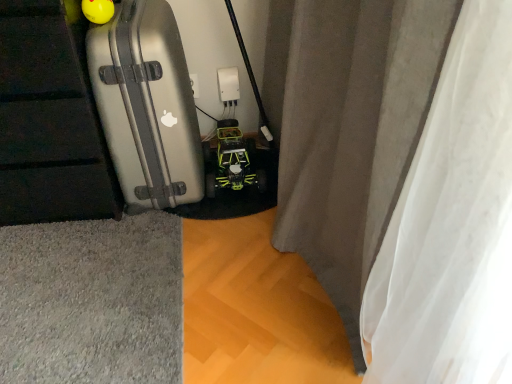
Question: Is silver metallic suitcase at left situated inside gray fabric curtain at center or outside?

Choices:
 (A) outside
 (B) inside

Answer: (A)

Question: In terms of width, does silver metallic suitcase at left look wider or thinner when compared to gray fabric curtain at center?

Choices:
 (A) wide
 (B) thin

Answer: (A)

Question: Considering the real-world distances, which object is closest to the gray fabric curtain at center?

Choices:
 (A) yellow-green plastic toy car at center
 (B) silver metallic suitcase at left

Answer: (B)

Question: Which object is the closest to the yellow-green plastic toy car at center?

Choices:
 (A) silver metallic suitcase at left
 (B) gray fabric curtain at center

Answer: (A)